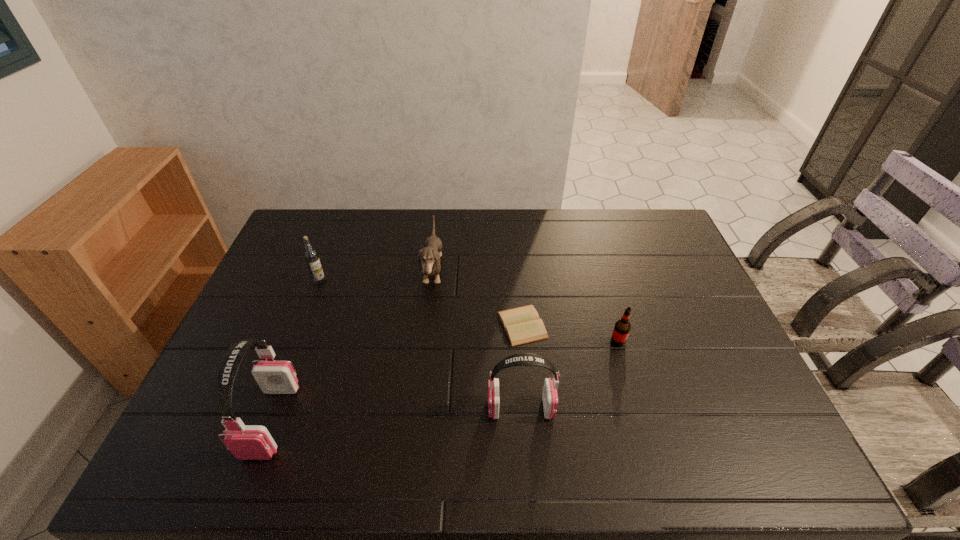
Identify the location of free area in between the right earphone and the shortest object. (521, 367).

This screenshot has height=540, width=960. I want to click on vacant region between the left earphone and the shortest object, so click(396, 373).

Identify the location of the fourth closest object to the vodka. (549, 395).

Locate which object ranks fifth in proximity to the vodka. Please provide its 2D coordinates. Your answer should be formatted as a tuple, i.e. [(x, y)], where the tuple contains the x and y coordinates of a point satisfying the conditions above.

[(622, 327)]

Identify the location of free location that satisfies the following two spatial constraints: 1. on the label of the shortest object; 2. on the right side of the vodka. (303, 325).

Identify the location of blank space that satisfies the following two spatial constraints: 1. on the back side of the shortest object; 2. at the face of the puppy. (517, 272).

Where is `blank space that satisfies the following two spatial constraints: 1. on the front side of the diary; 2. on the outer surface of the shorter earphone`? The height and width of the screenshot is (540, 960). blank space that satisfies the following two spatial constraints: 1. on the front side of the diary; 2. on the outer surface of the shorter earphone is located at coordinates (530, 408).

Find the location of a particular element. vacant region that satisfies the following two spatial constraints: 1. on the outer surface of the right earphone; 2. on the outer surface of the left earphone is located at coordinates (521, 420).

Locate an element on the screen. free space in the image that satisfies the following two spatial constraints: 1. at the face of the puppy; 2. on the label of the vodka is located at coordinates (432, 281).

Identify the location of free space that satisfies the following two spatial constraints: 1. at the face of the fourth object from right to left; 2. on the label of the vodka. (432, 281).